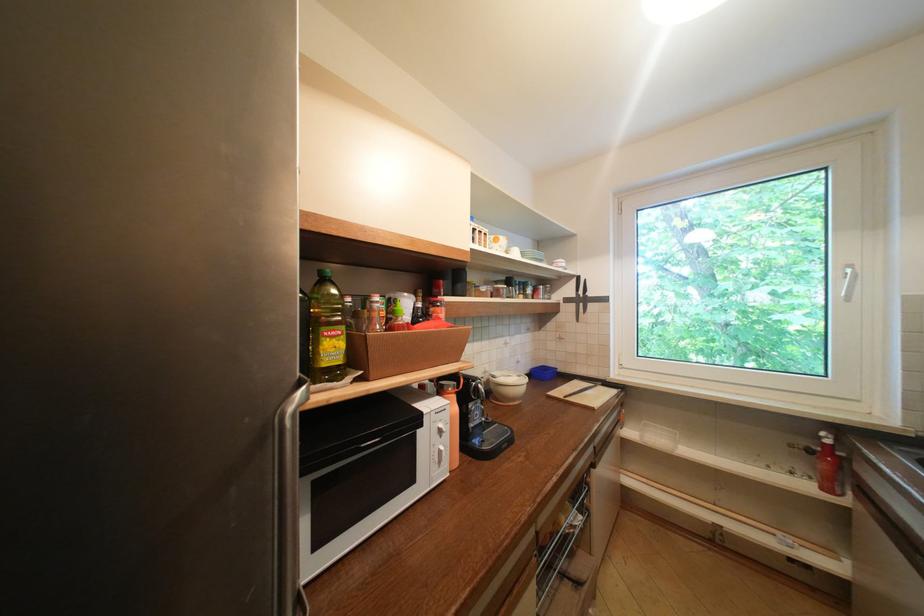
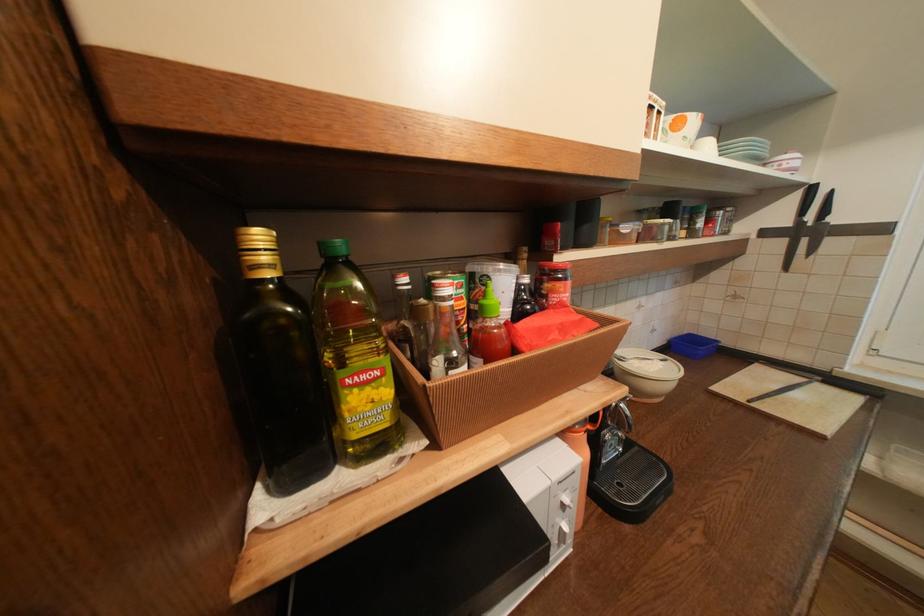
In the second image, find the point that corresponds to (503,237) in the first image.

(683, 118)